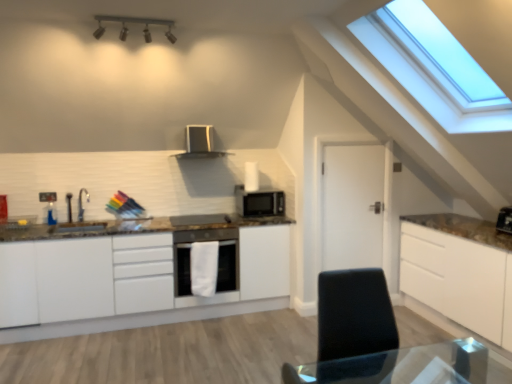
Question: From the image's perspective, is satin silver microwave at upper center below white matte door at center?

Choices:
 (A) yes
 (B) no

Answer: (B)

Question: Considering the relative positions of satin silver microwave at upper center and white matte door at center in the image provided, is satin silver microwave at upper center to the left of white matte door at center from the viewer's perspective?

Choices:
 (A) no
 (B) yes

Answer: (B)

Question: Is satin silver microwave at upper center to the right of white matte door at center from the viewer's perspective?

Choices:
 (A) yes
 (B) no

Answer: (B)

Question: Can you confirm if satin silver microwave at upper center is shorter than white matte door at center?

Choices:
 (A) no
 (B) yes

Answer: (B)

Question: From a real-world perspective, does satin silver microwave at upper center stand above white matte door at center?

Choices:
 (A) yes
 (B) no

Answer: (A)

Question: From the image's perspective, is satin silver microwave at upper center on top of white matte door at center?

Choices:
 (A) no
 (B) yes

Answer: (B)

Question: Is satin silver microwave at center aimed at satin silver microwave at upper center?

Choices:
 (A) yes
 (B) no

Answer: (B)

Question: Does satin silver microwave at center appear on the left side of satin silver microwave at upper center?

Choices:
 (A) yes
 (B) no

Answer: (B)

Question: From the image's perspective, is satin silver microwave at center located above satin silver microwave at upper center?

Choices:
 (A) no
 (B) yes

Answer: (A)

Question: From a real-world perspective, does satin silver microwave at center stand above satin silver microwave at upper center?

Choices:
 (A) no
 (B) yes

Answer: (A)

Question: Is satin silver microwave at center wider than satin silver microwave at upper center?

Choices:
 (A) no
 (B) yes

Answer: (B)

Question: From the image's perspective, is satin silver microwave at center beneath satin silver microwave at upper center?

Choices:
 (A) yes
 (B) no

Answer: (A)

Question: Can you confirm if white matte cabinet at center is thinner than white matte door at center?

Choices:
 (A) yes
 (B) no

Answer: (B)